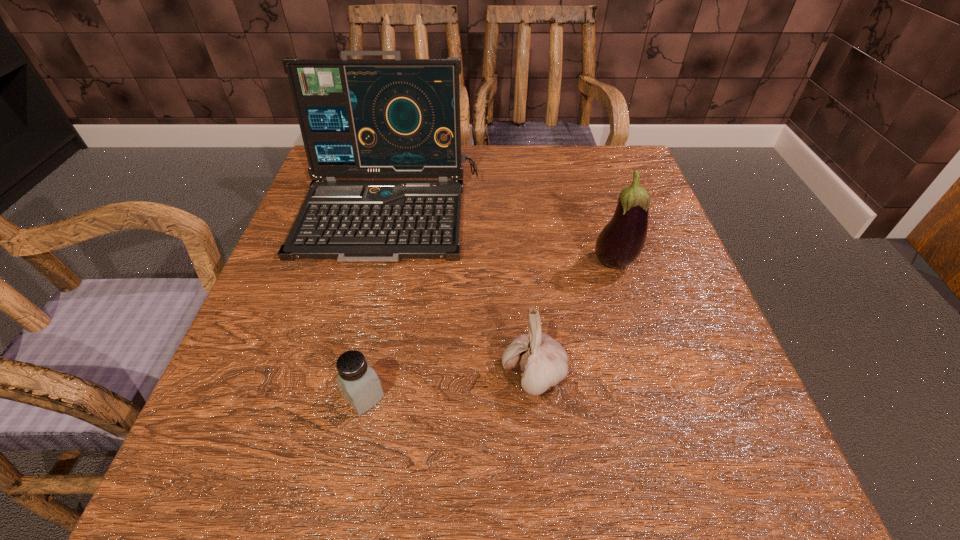
At what (x,y) coordinates should I click in order to perform the action: click on the tallest object. Please return your answer as a coordinate pair (x, y). Looking at the image, I should click on (359, 118).

At what (x,y) coordinates should I click in order to perform the action: click on eggplant. Please return your answer as a coordinate pair (x, y). The width and height of the screenshot is (960, 540). Looking at the image, I should click on (621, 241).

The width and height of the screenshot is (960, 540). Identify the location of the third shortest object. (621, 241).

Image resolution: width=960 pixels, height=540 pixels. What are the coordinates of `the second shortest object` in the screenshot? It's located at (542, 362).

The image size is (960, 540). Find the location of `the second object from right to left`. the second object from right to left is located at coordinates (542, 362).

This screenshot has width=960, height=540. I want to click on the shortest object, so click(359, 385).

This screenshot has width=960, height=540. What are the coordinates of `free space located 0.260m on the front-facing side of the tallest object` in the screenshot? It's located at point(350,387).

You are a GUI agent. You are given a task and a screenshot of the screen. Output one action in this format:
    pyautogui.click(x=<x>, y=<y>)
    Task: Click on the vacant space located on the left of the eggplant
    Image resolution: width=960 pixels, height=540 pixels.
    Given the screenshot: What is the action you would take?
    pyautogui.click(x=463, y=264)

Where is `vacant space located on the left of the second shortest object`? vacant space located on the left of the second shortest object is located at coordinates (372, 376).

I want to click on free space located on the right of the saltshaker, so click(607, 397).